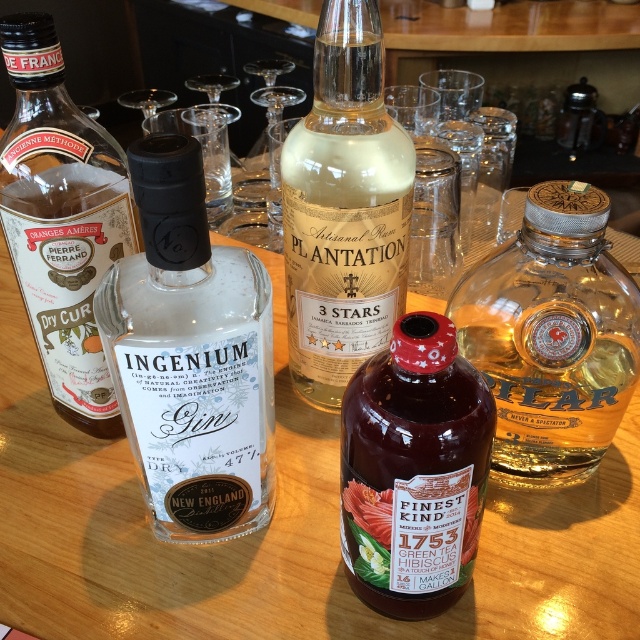
You are a bartender preparing a cocktail that requires both the clear glass gin at center and the clear glass bottle at left. Which of the two is shorter?

The clear glass gin at center is shorter than the clear glass bottle at left.

You are a bartender preparing a cocktail that requires the tallest bottle available. You have two bottles in front of you on the bar counter. One is a translucent glass bottle at center and the other is a purple glass bottle at center. Which bottle should you choose?

The translucent glass bottle at center is much taller than the purple glass bottle at center, so you should choose the translucent glass bottle at center.